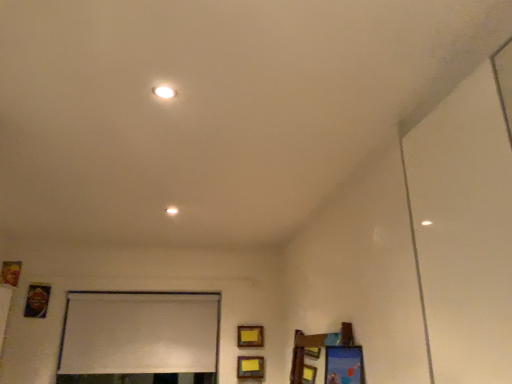
This screenshot has width=512, height=384. I want to click on white matte window screen at lower center, so click(139, 338).

In order to face white matte window screen at lower center, should I rotate leftwards or rightwards?

To face it directly, rotate left by 14.905 degrees.

The height and width of the screenshot is (384, 512). Describe the element at coordinates (10, 273) in the screenshot. I see `wooden picture frame at left, the fourth picture frame positioned from the right` at that location.

What do you see at coordinates (172, 211) in the screenshot?
I see `white glossy light at upper center` at bounding box center [172, 211].

Find the location of `white matte window screen at lower center`. white matte window screen at lower center is located at coordinates (139, 338).

Could you tell me if white matte window screen at lower center is turned towards matte yellow picture frame at lower center, the second picture frame viewed from the right?

No, white matte window screen at lower center does not turn towards matte yellow picture frame at lower center, the second picture frame viewed from the right.

Can we say white matte window screen at lower center lies outside matte yellow picture frame at lower center, the second picture frame viewed from the right?

white matte window screen at lower center is positioned outside matte yellow picture frame at lower center, the second picture frame viewed from the right.

Image resolution: width=512 pixels, height=384 pixels. What are the coordinates of `window screen located on the left of matte yellow picture frame at lower center, the first picture frame positioned from the bottom` in the screenshot? It's located at (139, 338).

From a real-world perspective, relative to matte yellow picture frame at lower center, the 4th picture frame positioned from the top, is white matte window screen at lower center vertically above or below?

Clearly, from a real-world perspective, white matte window screen at lower center is above matte yellow picture frame at lower center, the 4th picture frame positioned from the top.

Are white glossy light at upper center and matte yellow picture frame at lower center, the third picture frame viewed from the left, beside each other?

No, white glossy light at upper center is not next to matte yellow picture frame at lower center, the third picture frame viewed from the left.

Which point is more forward, (177, 213) or (260, 368)?

Point (177, 213)

Considering the sizes of white glossy light at upper center and matte yellow picture frame at lower center, the first picture frame positioned from the bottom, in the image, is white glossy light at upper center wider or thinner than matte yellow picture frame at lower center, the first picture frame positioned from the bottom,?

white glossy light at upper center is wider than matte yellow picture frame at lower center, the first picture frame positioned from the bottom.

Who is bigger, white glossy light at upper center or matte yellow picture frame at lower center, the 4th picture frame positioned from the top?

Bigger between the two is matte yellow picture frame at lower center, the 4th picture frame positioned from the top.

Between white matte window screen at lower center and metallic gold picture frame at lower left, positioned as the 2th picture frame in left-to-right order, which one has less height?

metallic gold picture frame at lower left, positioned as the 2th picture frame in left-to-right order.

Can you confirm if white matte window screen at lower center is thinner than metallic gold picture frame at lower left, the 3th picture frame when ordered from right to left?

No, white matte window screen at lower center is not thinner than metallic gold picture frame at lower left, the 3th picture frame when ordered from right to left.

Can you tell me how much white matte window screen at lower center and metallic gold picture frame at lower left, which is the 2th picture frame from top to bottom, differ in facing direction?

The angle between the facing direction of white matte window screen at lower center and the facing direction of metallic gold picture frame at lower left, which is the 2th picture frame from top to bottom, is 0.666 degrees.

Considering the positions of point (210, 369) and point (39, 304), is point (210, 369) closer or farther from the camera than point (39, 304)?

Point (210, 369) is farther from the camera than point (39, 304).

From the picture: Is matte yellow picture frame at lower center, the 4th picture frame positioned from the top, thinner than matte yellow picture frame at center, the 2th picture frame from the bottom?

No.

This screenshot has height=384, width=512. Find the location of `picture frame that is the 1st object located above the matte yellow picture frame at lower center, the third picture frame viewed from the left (from the image's perspective)`. picture frame that is the 1st object located above the matte yellow picture frame at lower center, the third picture frame viewed from the left (from the image's perspective) is located at coordinates (250, 336).

From a real-world perspective, between matte yellow picture frame at lower center, the second picture frame viewed from the right, and matte yellow picture frame at center, the 2th picture frame from the bottom, who is vertically higher?

From a 3D spatial view, matte yellow picture frame at center, the 2th picture frame from the bottom, is above.

Is matte yellow picture frame at lower center, the third picture frame viewed from the left, placed right next to matte yellow picture frame at center, which appears as the fourth picture frame when viewed from the left?

matte yellow picture frame at lower center, the third picture frame viewed from the left, is not next to matte yellow picture frame at center, which appears as the fourth picture frame when viewed from the left, and they're not touching.

Which of these two, metallic gold picture frame at lower left, which ranks as the 3th picture frame in bottom-to-top order, or white glossy light at upper center, is thinner?

metallic gold picture frame at lower left, which ranks as the 3th picture frame in bottom-to-top order, is thinner.

From the image's perspective, which object appears higher, metallic gold picture frame at lower left, which ranks as the 3th picture frame in bottom-to-top order, or white glossy light at upper center?

white glossy light at upper center is shown above in the image.

Does metallic gold picture frame at lower left, which ranks as the 3th picture frame in bottom-to-top order, lie behind white glossy light at upper center?

That is True.

Is metallic gold picture frame at lower left, positioned as the 2th picture frame in left-to-right order, positioned with its back to white glossy light at upper center?

No.

Between matte yellow picture frame at center, which appears as the fourth picture frame when viewed from the left, and white glossy light at upper center, which one has smaller size?

white glossy light at upper center is smaller.

Is point (259, 328) positioned after point (174, 214)?

Yes, point (259, 328) is farther from viewer.

Between matte yellow picture frame at center, arranged as the 3th picture frame when viewed from the top, and white glossy light at upper center, which one has smaller width?

With smaller width is matte yellow picture frame at center, arranged as the 3th picture frame when viewed from the top.

Who is shorter, matte yellow picture frame at center, the first picture frame in the right-to-left sequence, or white glossy light at upper center?

With less height is white glossy light at upper center.

How different are the orientations of wooden picture frame at left, arranged as the first picture frame when viewed from the top, and matte yellow picture frame at center, arranged as the 3th picture frame when viewed from the top, in degrees?

The angle between the facing direction of wooden picture frame at left, arranged as the first picture frame when viewed from the top, and the facing direction of matte yellow picture frame at center, arranged as the 3th picture frame when viewed from the top, is 0.00977 degrees.

Is wooden picture frame at left, the 4th picture frame when ordered from bottom to top, oriented towards matte yellow picture frame at center, the first picture frame in the right-to-left sequence?

No, wooden picture frame at left, the 4th picture frame when ordered from bottom to top, is not turned towards matte yellow picture frame at center, the first picture frame in the right-to-left sequence.

Considering the sizes of objects wooden picture frame at left, arranged as the first picture frame when viewed from the top, and matte yellow picture frame at center, which appears as the fourth picture frame when viewed from the left, in the image provided, who is taller, wooden picture frame at left, arranged as the first picture frame when viewed from the top, or matte yellow picture frame at center, which appears as the fourth picture frame when viewed from the left,?

wooden picture frame at left, arranged as the first picture frame when viewed from the top, is taller.

Find the location of a particular element. Image resolution: width=512 pixels, height=384 pixels. the 2nd picture frame positioned below the wooden picture frame at left, the first picture frame viewed from the left (from the image's perspective) is located at coordinates [x=250, y=336].

Which picture frame is the 2nd one when counting from the back of the white matte window screen at lower center? Please provide its 2D coordinates.

[(250, 367)]

This screenshot has width=512, height=384. I want to click on light on the left side of matte yellow picture frame at lower center, the second picture frame viewed from the right, so click(172, 211).

Which object lies further to the anchor point metallic gold picture frame at lower left, which ranks as the 3th picture frame in bottom-to-top order, matte yellow picture frame at lower center, the 4th picture frame positioned from the top, or matte yellow picture frame at center, which appears as the fourth picture frame when viewed from the left?

Based on the image, matte yellow picture frame at lower center, the 4th picture frame positioned from the top, appears to be further to metallic gold picture frame at lower left, which ranks as the 3th picture frame in bottom-to-top order.

From the image, which object appears to be farther from matte yellow picture frame at lower center, the third picture frame viewed from the left, wooden picture frame at left, the first picture frame viewed from the left, or metallic gold picture frame at lower left, which ranks as the 3th picture frame in bottom-to-top order?

wooden picture frame at left, the first picture frame viewed from the left, lies further to matte yellow picture frame at lower center, the third picture frame viewed from the left, than the other object.

Considering their positions, is metallic gold picture frame at lower left, the 3th picture frame when ordered from right to left, positioned further to white glossy light at upper center than white matte window screen at lower center?

Among the two, metallic gold picture frame at lower left, the 3th picture frame when ordered from right to left, is located further to white glossy light at upper center.

Looking at the image, which one is located further to matte yellow picture frame at lower center, the second picture frame viewed from the right, wooden picture frame at left, the 4th picture frame when ordered from bottom to top, or matte yellow picture frame at center, the first picture frame in the right-to-left sequence?

wooden picture frame at left, the 4th picture frame when ordered from bottom to top, is further to matte yellow picture frame at lower center, the second picture frame viewed from the right.

Looking at the image, which one is located closer to metallic gold picture frame at lower left, which ranks as the 3th picture frame in bottom-to-top order, matte yellow picture frame at center, the first picture frame in the right-to-left sequence, or wooden picture frame at left, arranged as the first picture frame when viewed from the top?

wooden picture frame at left, arranged as the first picture frame when viewed from the top, is positioned closer to the anchor metallic gold picture frame at lower left, which ranks as the 3th picture frame in bottom-to-top order.

When comparing their distances from matte yellow picture frame at center, arranged as the 3th picture frame when viewed from the top, does white matte window screen at lower center or matte yellow picture frame at lower center, the second picture frame viewed from the right, seem further?

Among the two, white matte window screen at lower center is located further to matte yellow picture frame at center, arranged as the 3th picture frame when viewed from the top.

Consider the image. When comparing their distances from matte yellow picture frame at center, which appears as the fourth picture frame when viewed from the left, does metallic gold picture frame at lower left, which is the 2th picture frame from top to bottom, or matte yellow picture frame at lower center, the third picture frame viewed from the left, seem closer?

Among the two, matte yellow picture frame at lower center, the third picture frame viewed from the left, is located nearer to matte yellow picture frame at center, which appears as the fourth picture frame when viewed from the left.

Considering their positions, is white matte window screen at lower center positioned further to matte yellow picture frame at center, the 2th picture frame from the bottom, than metallic gold picture frame at lower left, which is the 2th picture frame from top to bottom?

metallic gold picture frame at lower left, which is the 2th picture frame from top to bottom.

Identify the location of light between metallic gold picture frame at lower left, positioned as the 2th picture frame in left-to-right order, and matte yellow picture frame at lower center, the third picture frame viewed from the left, from left to right. (172, 211).

The height and width of the screenshot is (384, 512). Find the location of `window screen that lies between white glossy light at upper center and matte yellow picture frame at center, which appears as the fourth picture frame when viewed from the left, from top to bottom`. window screen that lies between white glossy light at upper center and matte yellow picture frame at center, which appears as the fourth picture frame when viewed from the left, from top to bottom is located at coordinates (139, 338).

The height and width of the screenshot is (384, 512). Identify the location of window screen located between metallic gold picture frame at lower left, which is the 2th picture frame from top to bottom, and white glossy light at upper center in the left-right direction. (139, 338).

In order to click on light situated between metallic gold picture frame at lower left, the 3th picture frame when ordered from right to left, and matte yellow picture frame at center, arranged as the 3th picture frame when viewed from the top, from left to right in this screenshot , I will do tap(172, 211).